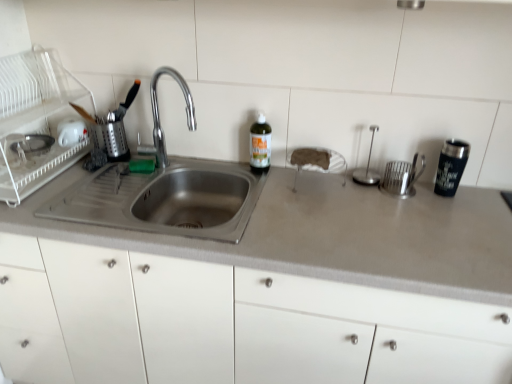
This screenshot has width=512, height=384. Find the location of `free location to the right of black stainless steel tumbler at right`. free location to the right of black stainless steel tumbler at right is located at coordinates click(x=482, y=199).